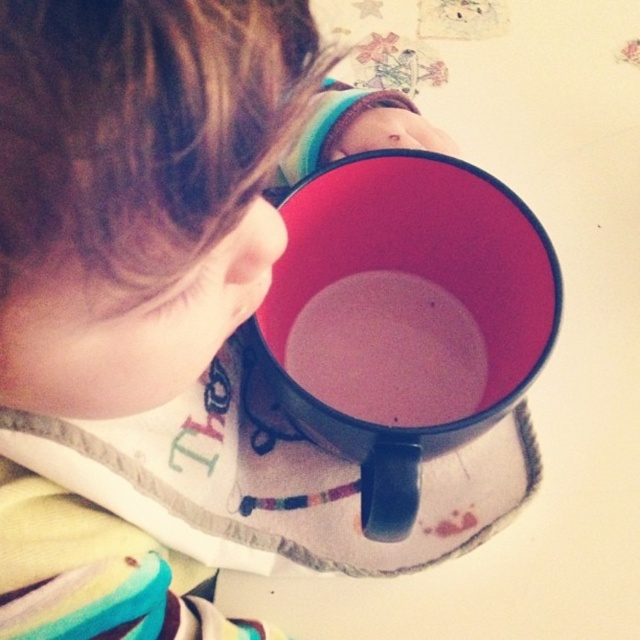
Question: Among these points, which one is nearest to the camera?

Choices:
 (A) (200, 253)
 (B) (472, 259)

Answer: (A)

Question: Which point is farther to the camera?

Choices:
 (A) matte black mug at center
 (B) matte black cup at upper center

Answer: (A)

Question: Is matte black cup at upper center to the left of matte black mug at center from the viewer's perspective?

Choices:
 (A) yes
 (B) no

Answer: (A)

Question: Can you confirm if matte black cup at upper center is positioned to the left of matte black mug at center?

Choices:
 (A) no
 (B) yes

Answer: (B)

Question: Which point is closer to the camera taking this photo?

Choices:
 (A) (97, 35)
 (B) (340, 432)

Answer: (A)

Question: Is matte black cup at upper center below matte black mug at center?

Choices:
 (A) yes
 (B) no

Answer: (A)